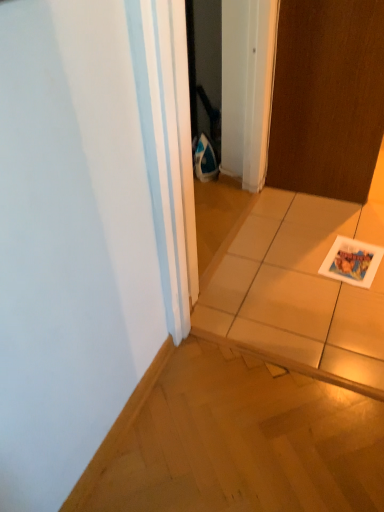
Locate an element on the screen. This screenshot has height=512, width=384. empty space that is ontop of white glossy postcard at lower right is located at coordinates (349, 257).